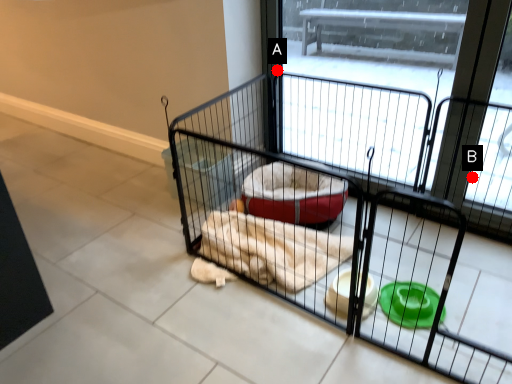
Question: Two points are circled on the image, labeled by A and B beside each circle. Which point appears farthest from the camera in this image?

Choices:
 (A) A is further
 (B) B is further

Answer: (A)